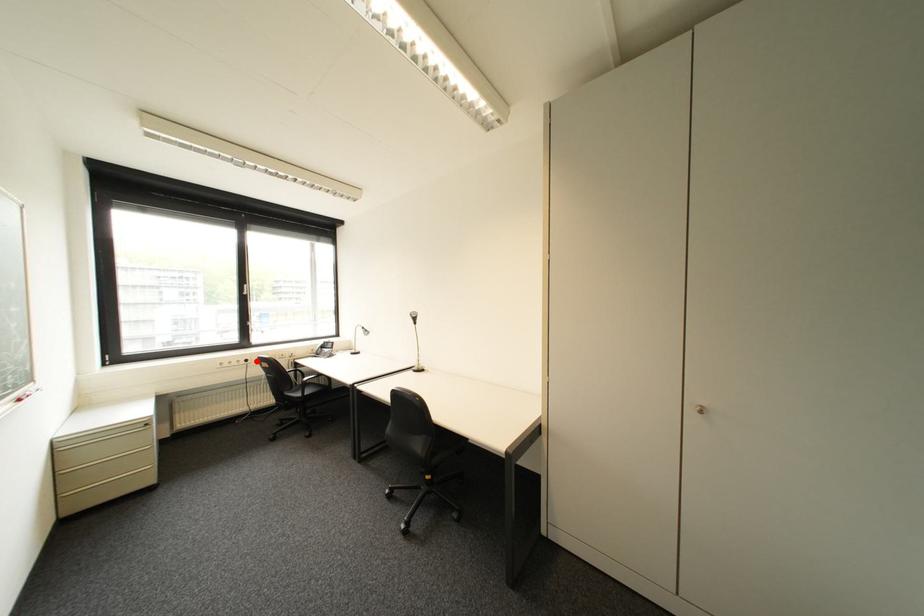
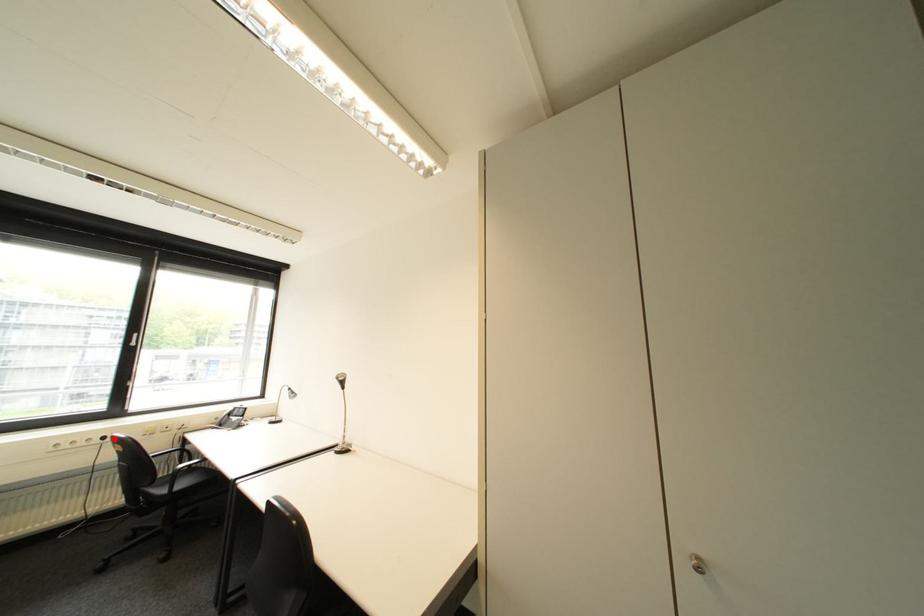
I am providing you with two images of the same scene from different viewpoints. A red point is marked on the first image and another point is marked on the second image. Are the points marked in image1 and image2 representing the same 3D position?

Yes